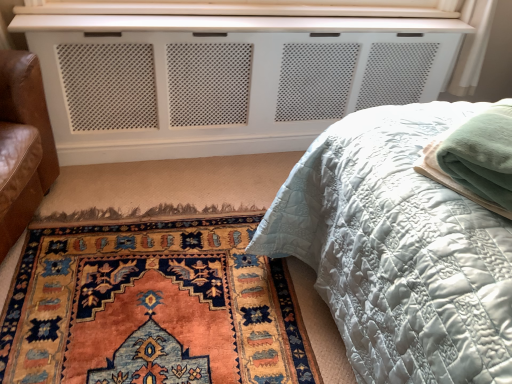
Question: Is point (x=340, y=248) positioned closer to the camera than point (x=244, y=64)?

Choices:
 (A) closer
 (B) farther

Answer: (A)

Question: Looking at the image, does matte white quilted bed at center seem bigger or smaller compared to white perforated panel at upper center?

Choices:
 (A) small
 (B) big

Answer: (B)

Question: Considering the real-world distances, which object is closest to the white perforated panel at upper center?

Choices:
 (A) green fleece blanket at right
 (B) matte white quilted bed at center
 (C) carpet with intricate patterns at lower left

Answer: (C)

Question: Considering the real-world distances, which object is farthest from the green fleece blanket at right?

Choices:
 (A) carpet with intricate patterns at lower left
 (B) white perforated panel at upper center
 (C) matte white quilted bed at center

Answer: (B)